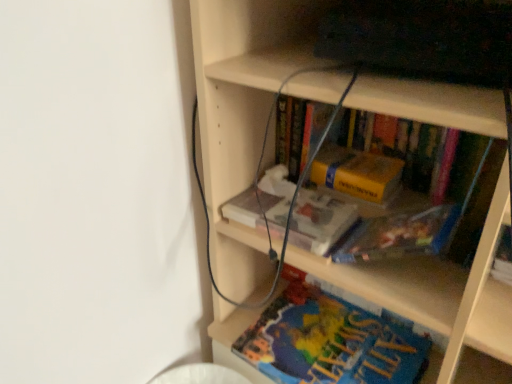
Question: From a real-world perspective, is wooden bookcase at center located higher than yellow matte book at center, positioned as the 1th book in top-to-bottom order?

Choices:
 (A) yes
 (B) no

Answer: (B)

Question: Does wooden bookcase at center have a larger size compared to yellow matte book at center, positioned as the 1th book in top-to-bottom order?

Choices:
 (A) no
 (B) yes

Answer: (B)

Question: Is wooden bookcase at center at the right side of yellow matte book at center, which is the 2th book from bottom to top?

Choices:
 (A) no
 (B) yes

Answer: (B)

Question: From the image's perspective, is wooden bookcase at center located above yellow matte book at center, which is the 2th book from bottom to top?

Choices:
 (A) no
 (B) yes

Answer: (A)

Question: Is wooden bookcase at center positioned far away from yellow matte book at center, positioned as the 1th book in top-to-bottom order?

Choices:
 (A) no
 (B) yes

Answer: (A)

Question: Is wooden bookcase at center in front of yellow matte book at center, positioned as the 1th book in top-to-bottom order?

Choices:
 (A) yes
 (B) no

Answer: (A)

Question: Is blue matte book at lower center, which is counted as the 1th book, starting from the bottom, far from yellow matte book at center, which is the 2th book from bottom to top?

Choices:
 (A) yes
 (B) no

Answer: (B)

Question: Does blue matte book at lower center, positioned as the 2th book in top-to-bottom order, have a greater height compared to yellow matte book at center, which is the 2th book from bottom to top?

Choices:
 (A) yes
 (B) no

Answer: (B)

Question: Could you tell me if blue matte book at lower center, positioned as the 2th book in top-to-bottom order, is turned towards yellow matte book at center, which is the 2th book from bottom to top?

Choices:
 (A) no
 (B) yes

Answer: (A)

Question: Does blue matte book at lower center, positioned as the 2th book in top-to-bottom order, have a greater width compared to yellow matte book at center, positioned as the 1th book in top-to-bottom order?

Choices:
 (A) yes
 (B) no

Answer: (A)

Question: From the image's perspective, does blue matte book at lower center, which is counted as the 1th book, starting from the bottom, appear higher than yellow matte book at center, which is the 2th book from bottom to top?

Choices:
 (A) yes
 (B) no

Answer: (B)

Question: Is blue matte book at lower center, positioned as the 2th book in top-to-bottom order, completely or partially outside of yellow matte book at center, positioned as the 1th book in top-to-bottom order?

Choices:
 (A) yes
 (B) no

Answer: (A)

Question: Is yellow matte book at center, which is the 2th book from bottom to top, at the right side of wooden bookcase at center?

Choices:
 (A) yes
 (B) no

Answer: (B)